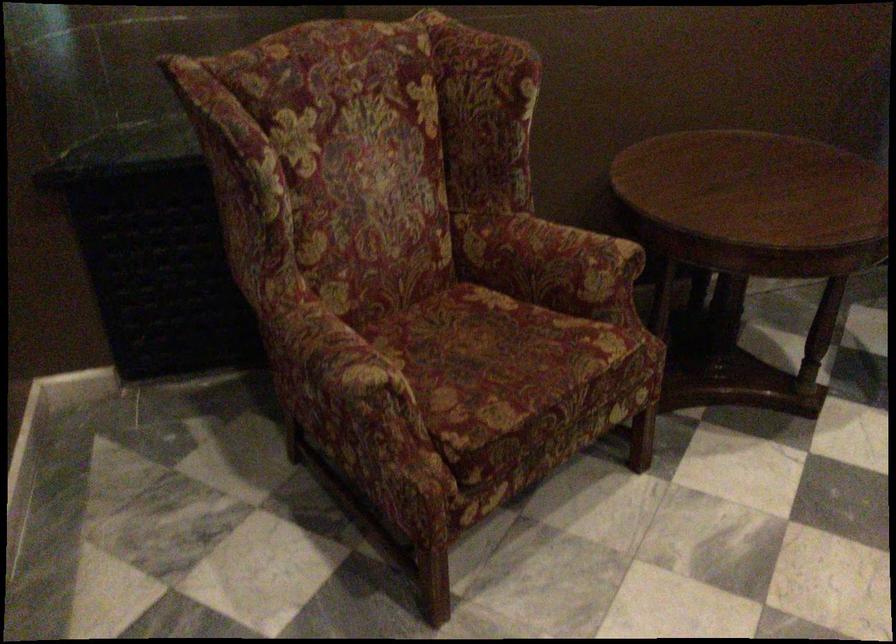
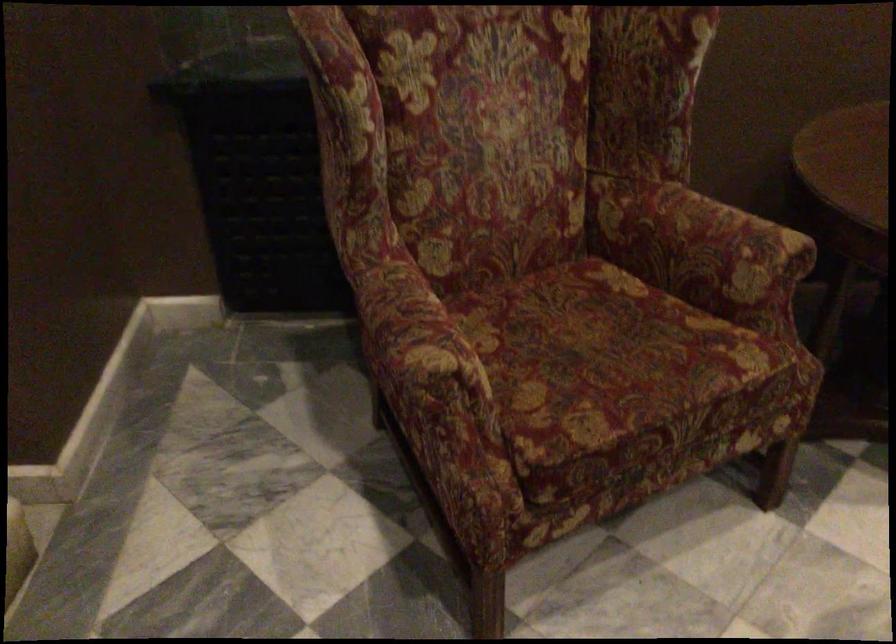
In a continuous first-person perspective shot, in which direction is the camera moving?

The cameraman walked toward right, forward.